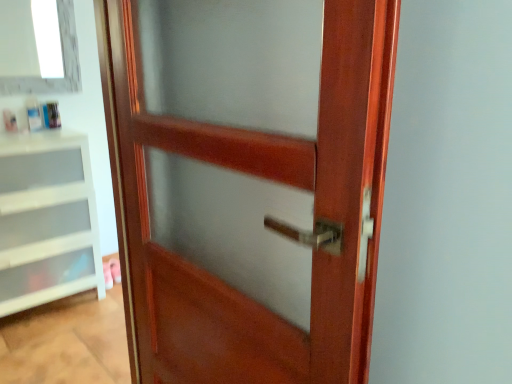
Describe the element at coordinates (63, 62) in the screenshot. I see `white glass window at upper left` at that location.

Identify the location of white glass window at upper left. (63, 62).

Does mahogany wood door at center have a lesser width compared to white glass window at upper left?

In fact, mahogany wood door at center might be wider than white glass window at upper left.

From the image's perspective, which is above, mahogany wood door at center or white glass window at upper left?

From the image's view, white glass window at upper left is above.

Consider the image. Is mahogany wood door at center turned away from white glass window at upper left?

No, white glass window at upper left is not at the back of mahogany wood door at center.

Considering the sizes of objects mahogany wood door at center and white glass window at upper left in the image provided, who is bigger, mahogany wood door at center or white glass window at upper left?

Bigger between the two is mahogany wood door at center.

Between white plastic drawer at left and mahogany wood door at center, which one appears on the left side from the viewer's perspective?

From the viewer's perspective, white plastic drawer at left appears more on the left side.

Which is farther from the camera, [13,170] or [125,139]?

The point [13,170] is behind.

From the image's perspective, is white plastic drawer at left on top of mahogany wood door at center?

Yes.

Between white plastic drawer at left and mahogany wood door at center, which one has larger size?

With larger size is white plastic drawer at left.

From a real-world perspective, between mahogany wood door at center and white plastic drawer at left, who is vertically lower?

From a 3D spatial view, white plastic drawer at left is below.

Which of these two, mahogany wood door at center or white plastic drawer at left, is smaller?

Smaller between the two is mahogany wood door at center.

I want to click on shelf directly beneath the mahogany wood door at center (from a real-world perspective), so click(47, 220).

Is mahogany wood door at center far from white plastic drawer at left?

Absolutely, mahogany wood door at center is distant from white plastic drawer at left.

Considering the relative sizes of white plastic drawer at left and white glass window at upper left in the image provided, is white plastic drawer at left shorter than white glass window at upper left?

No.

From a real-world perspective, is white plastic drawer at left under white glass window at upper left?

Yes, from a real-world perspective, white plastic drawer at left is below white glass window at upper left.

How different are the orientations of white plastic drawer at left and white glass window at upper left in degrees?

They differ by 2.1 degrees in their facing directions.

Is point (22, 265) closer or farther from the camera than point (74, 21)?

Point (22, 265) is closer to the camera than point (74, 21).

Would you say white glass window at upper left is to the left or to the right of mahogany wood door at center in the picture?

Clearly, white glass window at upper left is on the left of mahogany wood door at center in the image.

How far apart are white glass window at upper left and mahogany wood door at center?

white glass window at upper left and mahogany wood door at center are 6.06 feet apart.

Is white glass window at upper left shorter than mahogany wood door at center?

Indeed, white glass window at upper left has a lesser height compared to mahogany wood door at center.

Choose the correct answer: Is white glass window at upper left inside white plastic drawer at left or outside it?

white glass window at upper left exists outside the volume of white plastic drawer at left.

From the image's perspective, which one is positioned lower, white glass window at upper left or white plastic drawer at left?

white plastic drawer at left, from the image's perspective.

Find the location of a particular element. shelf located in front of the white glass window at upper left is located at coordinates click(x=47, y=220).

Which of these two, white glass window at upper left or white plastic drawer at left, is wider?

Wider between the two is white plastic drawer at left.

In the image, there is a white glass window at upper left. At what (x,y) coordinates should I click in order to perform the action: click on door below it (from a real-world perspective). Please return your answer as a coordinate pair (x, y). Looking at the image, I should click on (265, 218).

Find the location of a particular element. shelf that is on the left side of mahogany wood door at center is located at coordinates (47, 220).

Based on their spatial positions, is mahogany wood door at center or white plastic drawer at left closer to white glass window at upper left?

white plastic drawer at left is positioned closer to the anchor white glass window at upper left.

Estimate the real-world distances between objects in this image. Which object is closer to white plastic drawer at left, mahogany wood door at center or white glass window at upper left?

Among the two, white glass window at upper left is located nearer to white plastic drawer at left.

Based on their spatial positions, is white plastic drawer at left or mahogany wood door at center further from white glass window at upper left?

mahogany wood door at center is positioned further to the anchor white glass window at upper left.

Based on their spatial positions, is white plastic drawer at left or white glass window at upper left further from mahogany wood door at center?

white glass window at upper left lies further to mahogany wood door at center than the other object.

Looking at the image, which one is located further to white plastic drawer at left, white glass window at upper left or mahogany wood door at center?

The object further to white plastic drawer at left is mahogany wood door at center.

From the image, which object appears to be nearer to mahogany wood door at center, white glass window at upper left or white plastic drawer at left?

Among the two, white plastic drawer at left is located nearer to mahogany wood door at center.

Locate an element on the screen. The width and height of the screenshot is (512, 384). shelf between mahogany wood door at center and white glass window at upper left along the z-axis is located at coordinates (47, 220).